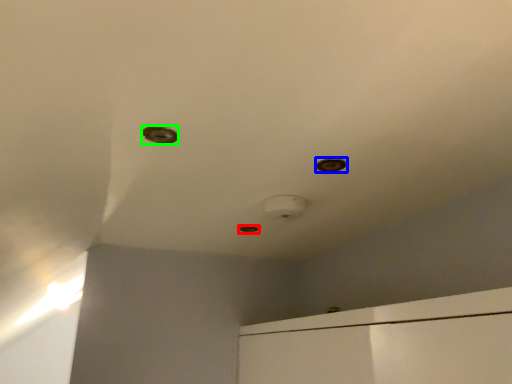
Question: Which is nearer to the hole (highlighted by a red box)? hole (highlighted by a blue box) or hole (highlighted by a green box).

Choices:
 (A) hole
 (B) hole

Answer: (A)